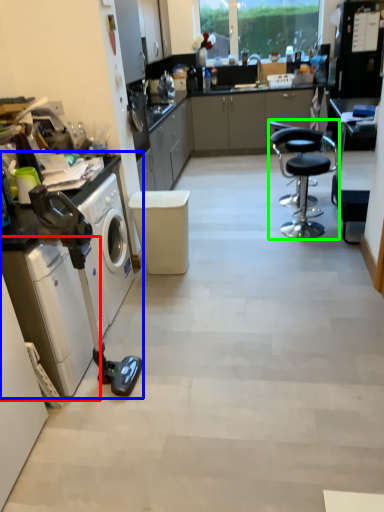
Question: Which is farther away from washing machine (highlighted by a red box)? home appliance (highlighted by a blue box) or chair (highlighted by a green box)?

Choices:
 (A) home appliance
 (B) chair

Answer: (B)